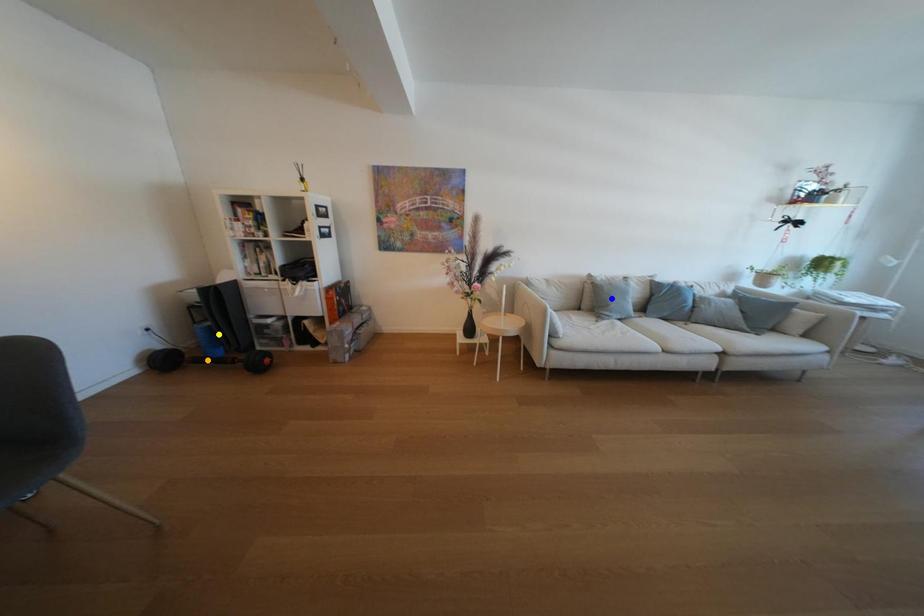
Order these from nearest to farthest:
blue point, orange point, yellow point

orange point < yellow point < blue point